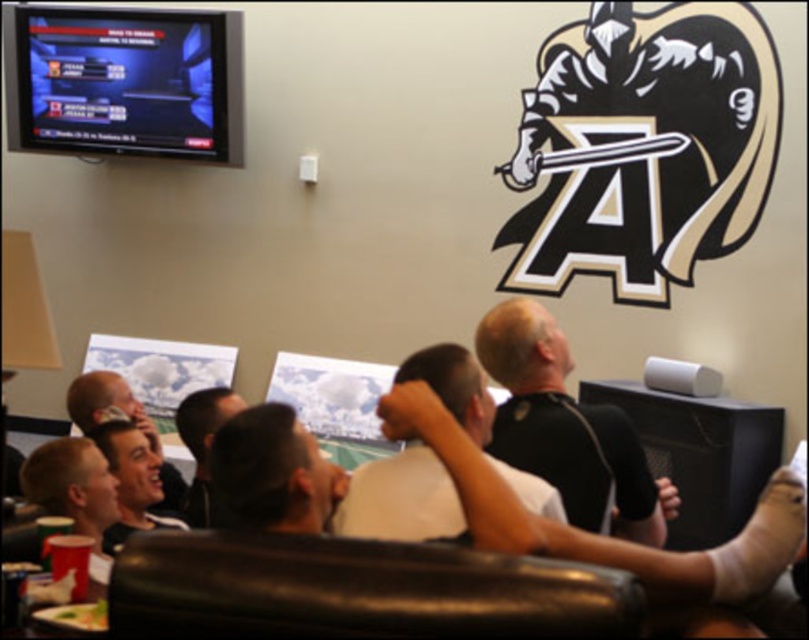
Which is in front, point (575, 595) or point (558, 520)?

Point (575, 595)

Does point (115, 628) come in front of point (386, 472)?

Yes.

Does point (534, 595) lie in front of point (375, 468)?

Yes, it is.

I want to click on black leather couch at lower center, so click(356, 589).

The width and height of the screenshot is (809, 640). What do you see at coordinates (400, 499) in the screenshot? I see `white matte shirt at center` at bounding box center [400, 499].

Which of these two, white matte shirt at center or dark brown hair at center, stands taller?

With more height is dark brown hair at center.

Is point (384, 509) closer to camera compared to point (188, 504)?

Yes.

Locate an element on the screen. The width and height of the screenshot is (809, 640). white matte shirt at center is located at coordinates (400, 499).

Can you confirm if black leather couch at lower center is thinner than black matte shirt at center?

In fact, black leather couch at lower center might be wider than black matte shirt at center.

Does black leather couch at lower center lie in front of black matte shirt at center?

Yes, black leather couch at lower center is closer to the viewer.

Is point (547, 609) farther from viewer compared to point (595, 524)?

No.

At what (x,y) coordinates should I click in order to perform the action: click on black leather couch at lower center. Please return your answer as a coordinate pair (x, y). Looking at the image, I should click on (356, 589).